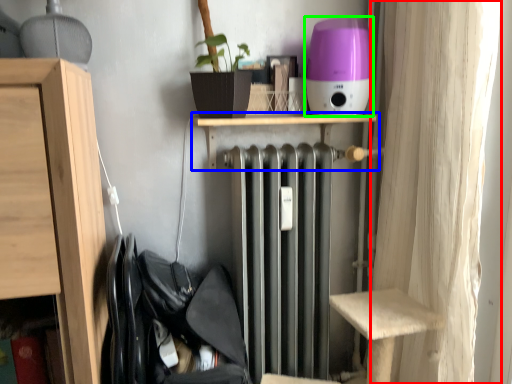
Question: Considering the real-world distances, which object is farthest from curtain (highlighted by a red box)? shelf (highlighted by a blue box) or appliance (highlighted by a green box)?

Choices:
 (A) shelf
 (B) appliance

Answer: (A)